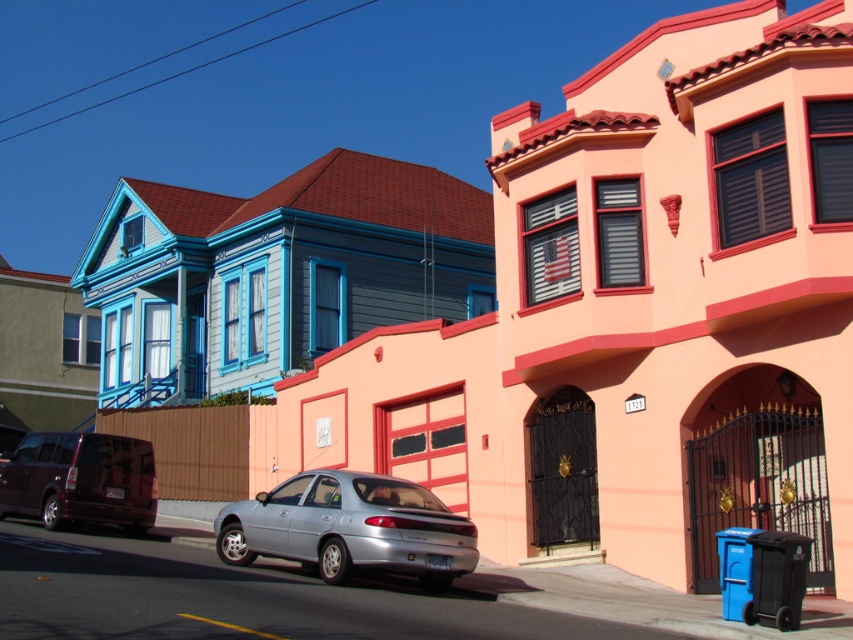
Can you confirm if silver metallic sedan at center is bigger than shiny dark purple van at lower left?

Actually, silver metallic sedan at center might be smaller than shiny dark purple van at lower left.

You are a GUI agent. You are given a task and a screenshot of the screen. Output one action in this format:
    pyautogui.click(x=<x>, y=<y>)
    Task: Click on the silver metallic sedan at center
    The image size is (853, 640).
    Given the screenshot: What is the action you would take?
    tap(350, 528)

Does point (439, 566) lie in front of point (78, 520)?

That is True.

Where is `silver metallic sedan at center`? This screenshot has height=640, width=853. silver metallic sedan at center is located at coordinates (350, 528).